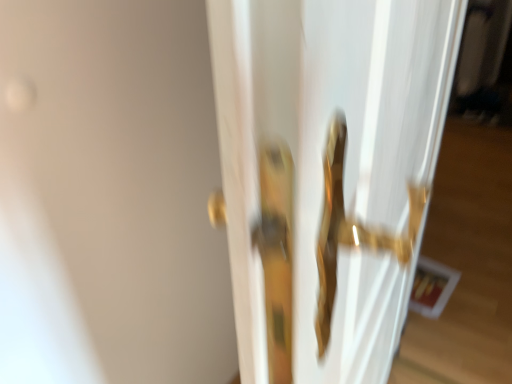
The height and width of the screenshot is (384, 512). Describe the element at coordinates (327, 174) in the screenshot. I see `gold polished door handle at center` at that location.

The image size is (512, 384). I want to click on gold polished door handle at center, so (x=327, y=174).

This screenshot has height=384, width=512. In order to click on gold polished door handle at center in this screenshot , I will do `click(327, 174)`.